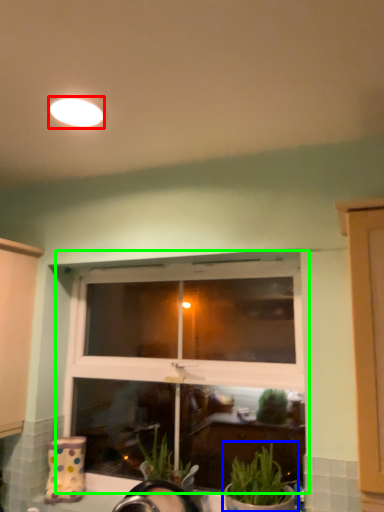
Question: Considering the real-world distances, which object is closest to lighting (highlighted by a red box)? houseplant (highlighted by a blue box) or window (highlighted by a green box).

Choices:
 (A) houseplant
 (B) window

Answer: (B)